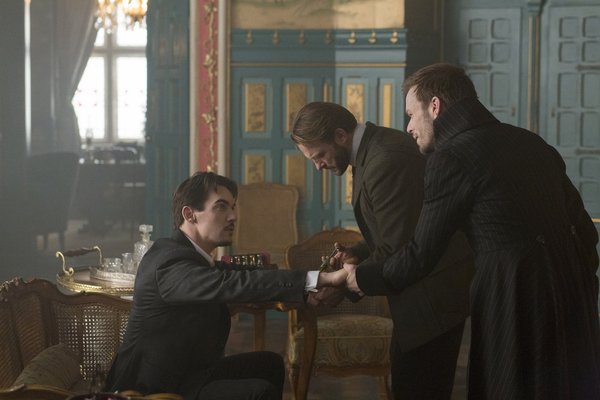
You are a GUI agent. You are given a task and a screenshot of the screen. Output one action in this format:
    pyautogui.click(x=<x>, y=<y>)
    Task: Click on the light fixture
    The height and width of the screenshot is (400, 600).
    Given the screenshot: What is the action you would take?
    click(135, 12)